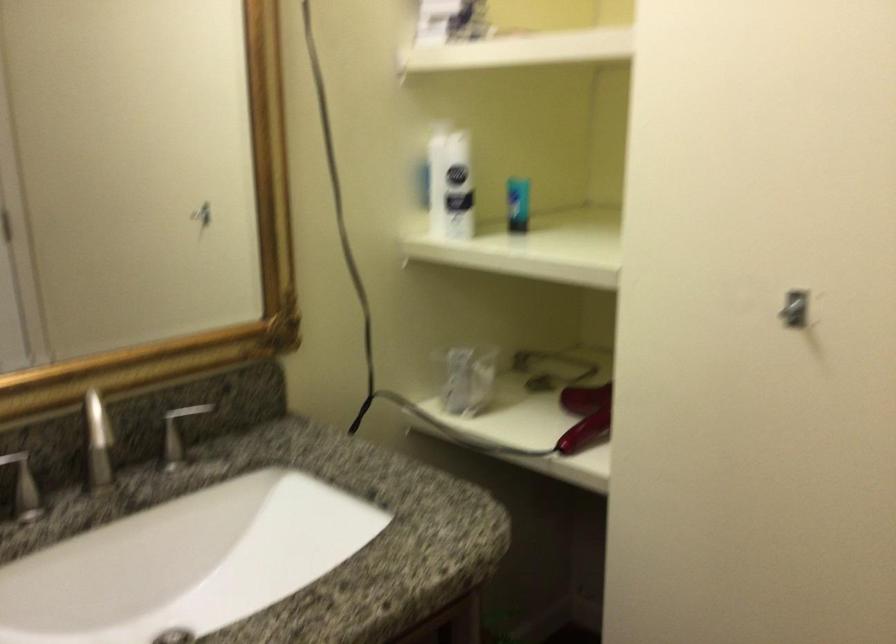
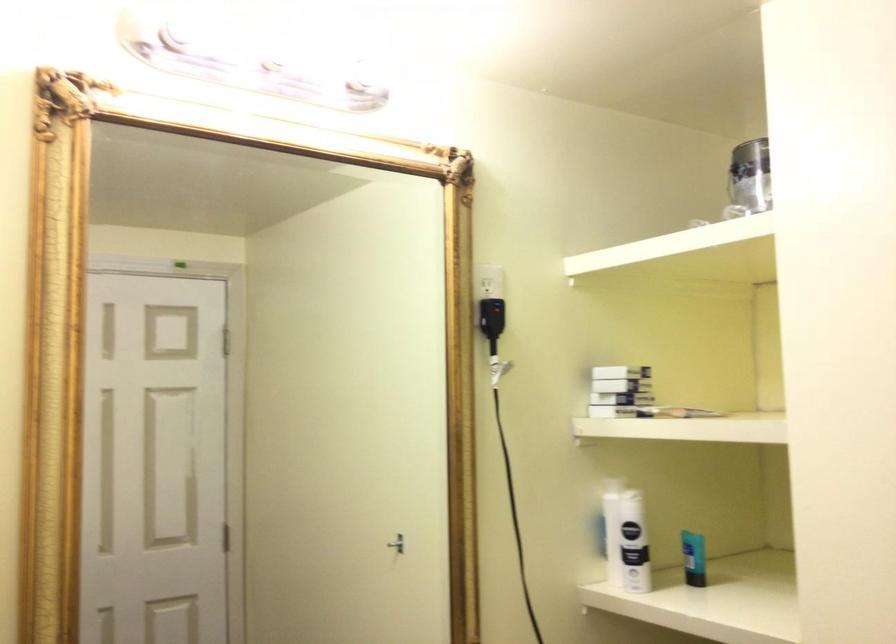
Where in the second image is the point corresponding to [451,183] from the first image?

(625, 538)